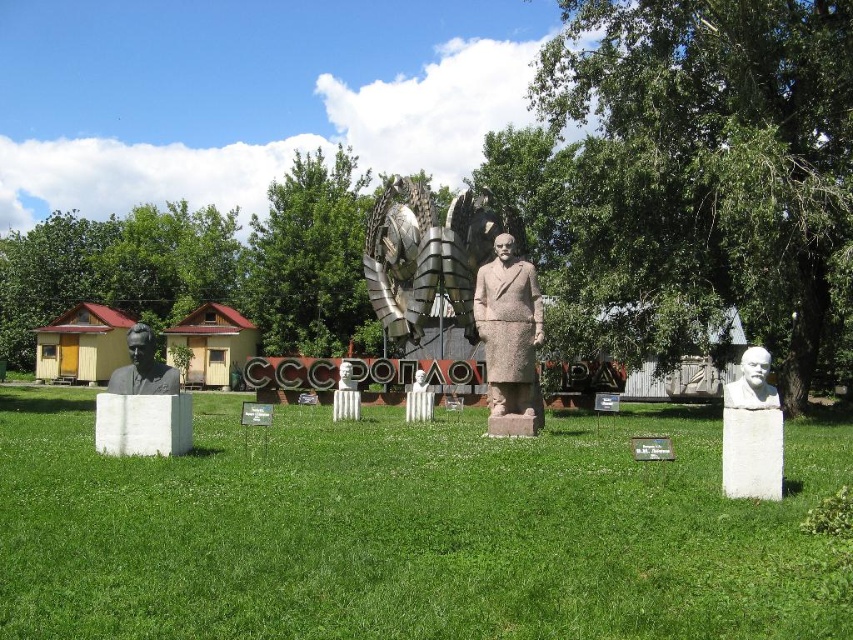
Does white marble bust at left appear on the left side of white marble bust at center?

Indeed, white marble bust at left is positioned on the left side of white marble bust at center.

Is point (167, 376) more distant than point (741, 406)?

Yes, it is.

Where is `white marble bust at left`? The height and width of the screenshot is (640, 853). white marble bust at left is located at coordinates (143, 368).

Is the position of green grass at center more distant than that of white marble bust at center?

No, green grass at center is closer to the viewer.

Which is behind, point (248, 627) or point (746, 390)?

Positioned behind is point (746, 390).

The height and width of the screenshot is (640, 853). What do you see at coordinates (405, 529) in the screenshot?
I see `green grass at center` at bounding box center [405, 529].

Where is `green grass at center`? This screenshot has width=853, height=640. green grass at center is located at coordinates (405, 529).

Can you confirm if gray stone statue at center is wider than white marble bust at center?

Yes.

Is gray stone statue at center to the right of white marble bust at center from the viewer's perspective?

Incorrect, gray stone statue at center is not on the right side of white marble bust at center.

What are the coordinates of `gray stone statue at center` in the screenshot? It's located at (509, 332).